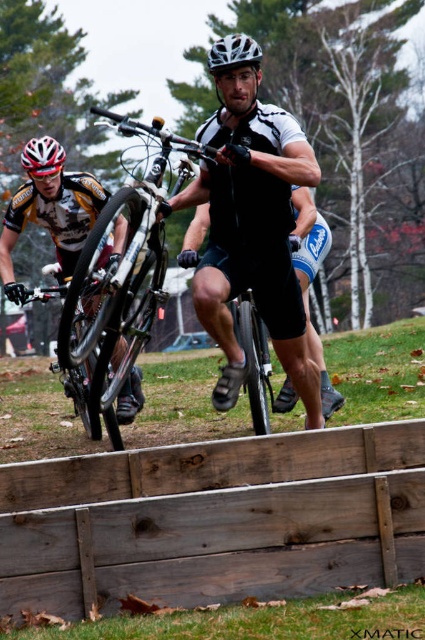
You are a photographer trying to capture the silver metallic mountain bike at center and the white matte bicycle helmet at upper left in the same frame. Based on their sizes in the image, which object should you focus on first to ensure both are in the frame?

The silver metallic mountain bike at center occupies less space than the white matte bicycle helmet at upper left, so you should focus on the white matte bicycle helmet at upper left first to ensure both are in the frame.

You are a photographer standing at the camera position. You want to capture a closeup shot of the silver metallic mountain bike at center. Considering the distance, can you use a standard lens with a maximum focus range of 4 meters?

The silver metallic mountain bike at center is 4.26 meters away from camera. Since the maximum focus range is 4 meters, the standard lens cannot focus on the bike as it is beyond the 4 meter limit.

You are a photographer capturing the action of the two mountain bikers. You need to focus your camera on both the silver metallic mountain bike at center and the white matte helmet at center. Which object should you adjust your focus to first if you want to capture the one closer to the camera?

The silver metallic mountain bike at center is positioned on the left side of the white matte helmet at center, so it is closer to the camera. Adjust focus to the silver metallic mountain bike at center first.